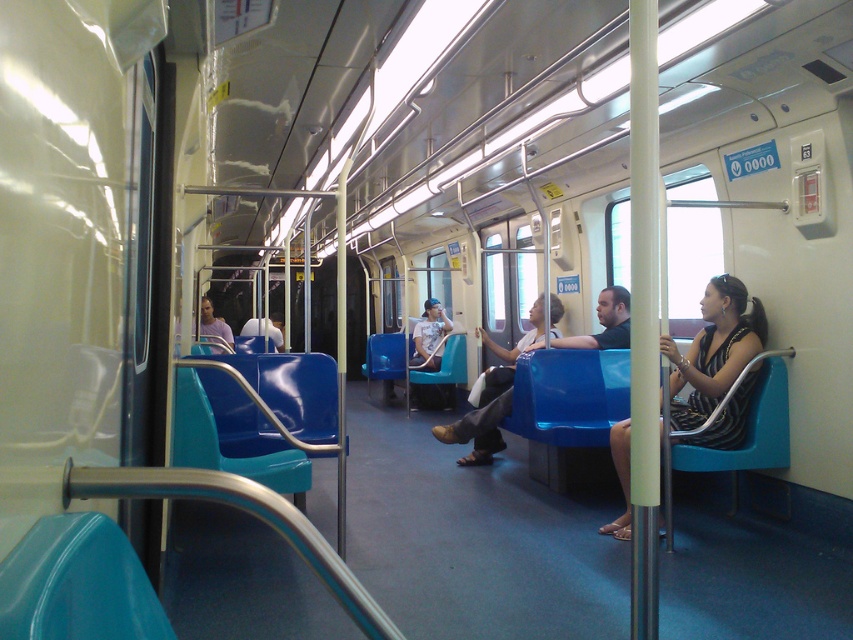
Question: Which object appears farthest from the camera in this image?

Choices:
 (A) striped fabric dress at center
 (B) matte blue seat at center

Answer: (B)

Question: Does striped fabric dress at center appear on the left side of matte blue seat at center?

Choices:
 (A) no
 (B) yes

Answer: (A)

Question: Can you confirm if striped fabric dress at center is wider than matte blue seat at center?

Choices:
 (A) yes
 (B) no

Answer: (B)

Question: Does striped fabric dress at center come behind matte blue seat at center?

Choices:
 (A) no
 (B) yes

Answer: (A)